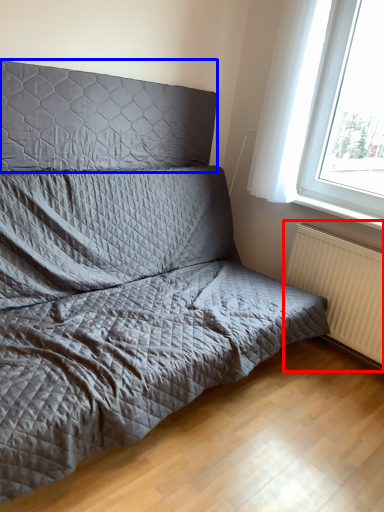
Question: Which of the following is the farthest to the observer, radiator (highlighted by a red box) or headboard (highlighted by a blue box)?

Choices:
 (A) radiator
 (B) headboard

Answer: (A)